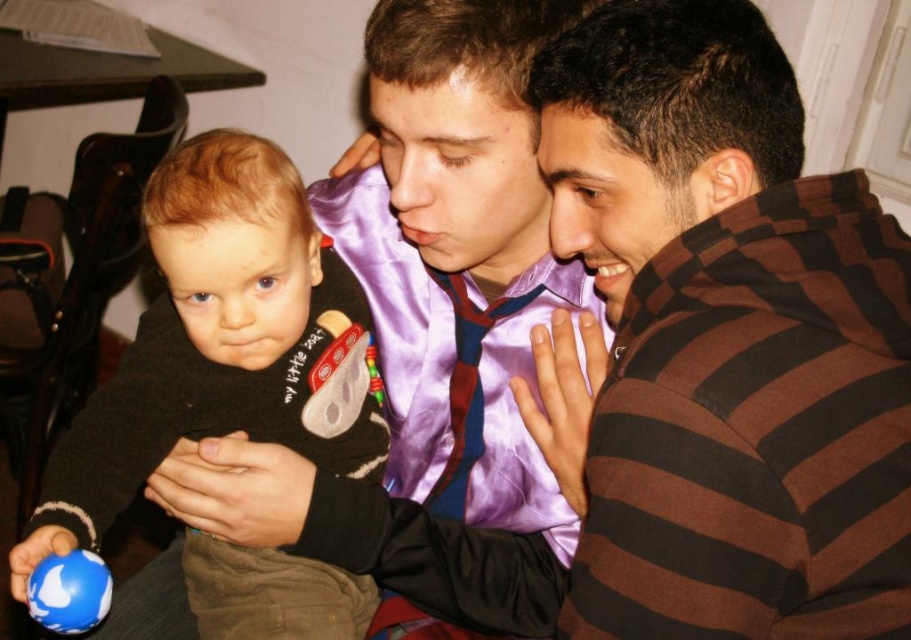
You are a toy store employee who needs to place the soft black sweater at center and the blue rubber ball at lower left on a shelf. The shelf has a width of 10 inches. Can both items fit side by side on the shelf without overlapping?

The soft black sweater at center is 9.14 inches from the blue rubber ball at lower left, so they can fit side by side on the 10 inch shelf since the total distance between them is less than the shelf width.

Looking at this image, in the scene, there is a young boy wearing a black sweater with white and red patterns at the center and two adults nearby. The adults are positioned to the right of the boy. One adult is wearing a purple satin shirt with a red tie, and the other is in a brown and black striped shirt. Based on the coordinates provided, which object corresponds to the point at location (220, 342)?

The point at (220, 342) corresponds to the soft black sweater at center.